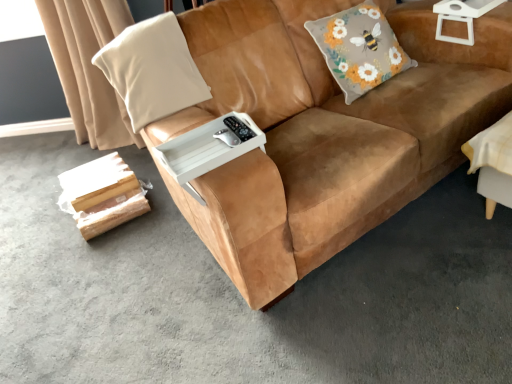
Question: Are beige fabric pillow at left, the second throw pillow when ordered from right to left, and white plastic side table at upper right making contact?

Choices:
 (A) yes
 (B) no

Answer: (B)

Question: Does beige fabric pillow at left, the second throw pillow when ordered from right to left, turn towards white plastic side table at upper right?

Choices:
 (A) no
 (B) yes

Answer: (A)

Question: Is beige fabric pillow at left, the second throw pillow when ordered from right to left, smaller than white plastic side table at upper right?

Choices:
 (A) yes
 (B) no

Answer: (B)

Question: Is beige fabric pillow at left, arranged as the first throw pillow when viewed from the left, closer to the viewer compared to white plastic side table at upper right?

Choices:
 (A) no
 (B) yes

Answer: (B)

Question: Considering the relative sizes of beige fabric pillow at left, the second throw pillow when ordered from right to left, and white plastic side table at upper right in the image provided, is beige fabric pillow at left, the second throw pillow when ordered from right to left, wider than white plastic side table at upper right?

Choices:
 (A) yes
 (B) no

Answer: (A)

Question: Is white plastic side table at upper right completely or partially inside beige fabric pillow at left, arranged as the first throw pillow when viewed from the left?

Choices:
 (A) yes
 (B) no

Answer: (B)

Question: Considering the relative sizes of beige fabric pillow at left, the second throw pillow when ordered from right to left, and fluffy gray cushion with floral design at upper right, acting as the 1th throw pillow starting from the right, in the image provided, is beige fabric pillow at left, the second throw pillow when ordered from right to left, taller than fluffy gray cushion with floral design at upper right, acting as the 1th throw pillow starting from the right,?

Choices:
 (A) no
 (B) yes

Answer: (A)

Question: Can you confirm if beige fabric pillow at left, arranged as the first throw pillow when viewed from the left, is positioned to the left of fluffy gray cushion with floral design at upper right, which ranks as the 2th throw pillow in left-to-right order?

Choices:
 (A) yes
 (B) no

Answer: (A)

Question: Is fluffy gray cushion with floral design at upper right, which ranks as the 2th throw pillow in left-to-right order, completely or partially inside beige fabric pillow at left, arranged as the first throw pillow when viewed from the left?

Choices:
 (A) no
 (B) yes

Answer: (A)

Question: Is beige fabric pillow at left, the second throw pillow when ordered from right to left, smaller than fluffy gray cushion with floral design at upper right, which ranks as the 2th throw pillow in left-to-right order?

Choices:
 (A) yes
 (B) no

Answer: (A)

Question: Can we say beige fabric pillow at left, the second throw pillow when ordered from right to left, lies outside fluffy gray cushion with floral design at upper right, which ranks as the 2th throw pillow in left-to-right order?

Choices:
 (A) yes
 (B) no

Answer: (A)

Question: Would you say beige fabric pillow at left, arranged as the first throw pillow when viewed from the left, is a long distance from fluffy gray cushion with floral design at upper right, which ranks as the 2th throw pillow in left-to-right order?

Choices:
 (A) yes
 (B) no

Answer: (B)

Question: Considering the relative sizes of suede brown couch at center and fluffy gray cushion with floral design at upper right, which ranks as the 2th throw pillow in left-to-right order, in the image provided, is suede brown couch at center thinner than fluffy gray cushion with floral design at upper right, which ranks as the 2th throw pillow in left-to-right order,?

Choices:
 (A) yes
 (B) no

Answer: (B)